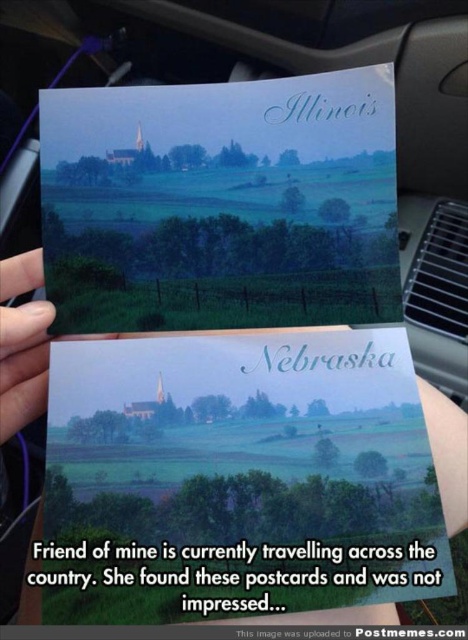
Question: Is matte paper postcard at upper center further to camera compared to white paper at center?

Choices:
 (A) yes
 (B) no

Answer: (A)

Question: Does white paper at center have a lesser width compared to matte black finger at lower left?

Choices:
 (A) yes
 (B) no

Answer: (B)

Question: Which object is closer to the camera taking this photo?

Choices:
 (A) matte paper postcard at center
 (B) matte black finger at lower left
 (C) white paper at center
 (D) matte paper postcard at upper center

Answer: (A)

Question: Which object appears closest to the camera in this image?

Choices:
 (A) matte black finger at lower left
 (B) white paper at center

Answer: (B)

Question: In this image, where is matte paper postcard at center located relative to matte paper postcard at upper center?

Choices:
 (A) right
 (B) left

Answer: (A)

Question: Which is farther from the matte paper postcard at center?

Choices:
 (A) matte paper postcard at upper center
 (B) matte black finger at lower left
 (C) white paper at center

Answer: (B)